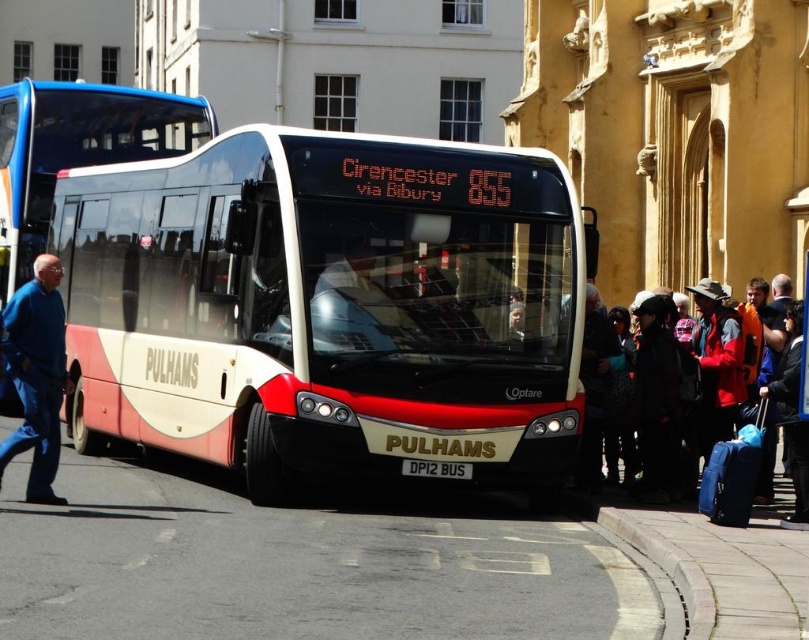
Does matte white and red bus at center appear on the left side of matte white bus at center?

In fact, matte white and red bus at center is to the right of matte white bus at center.

Between matte white and red bus at center and matte white bus at center, which one is positioned lower?

Positioned lower is matte white and red bus at center.

This screenshot has width=809, height=640. What do you see at coordinates (327, 307) in the screenshot?
I see `matte white and red bus at center` at bounding box center [327, 307].

Where is `matte white and red bus at center`? The image size is (809, 640). matte white and red bus at center is located at coordinates (327, 307).

Does matte white and red bus at center come behind blue fabric suitcase at right?

Yes, matte white and red bus at center is behind blue fabric suitcase at right.

Can you confirm if matte white and red bus at center is shorter than blue fabric suitcase at right?

Incorrect, matte white and red bus at center's height does not fall short of blue fabric suitcase at right's.

Which is in front, point (490, 454) or point (781, 406)?

Point (490, 454) is in front.

Where is `matte white and red bus at center`? matte white and red bus at center is located at coordinates (327, 307).

Does matte white bus at center have a lesser height compared to blue jeans at left?

No.

Does matte white bus at center appear on the left side of blue jeans at left?

Indeed, matte white bus at center is positioned on the left side of blue jeans at left.

Is point (61, 168) less distant than point (40, 291)?

No, it is not.

This screenshot has width=809, height=640. Find the location of `matte white bus at center`. matte white bus at center is located at coordinates (75, 148).